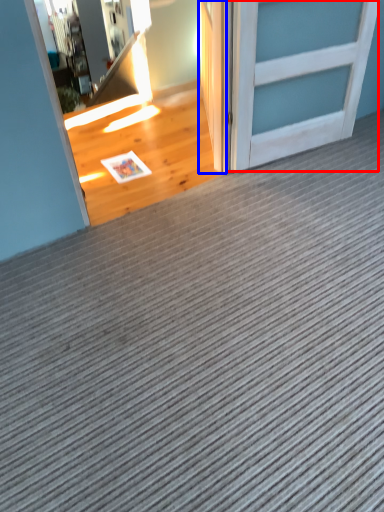
Question: Which of the following is the closest to the observer, door (highlighted by a red box) or door (highlighted by a blue box)?

Choices:
 (A) door
 (B) door

Answer: (A)